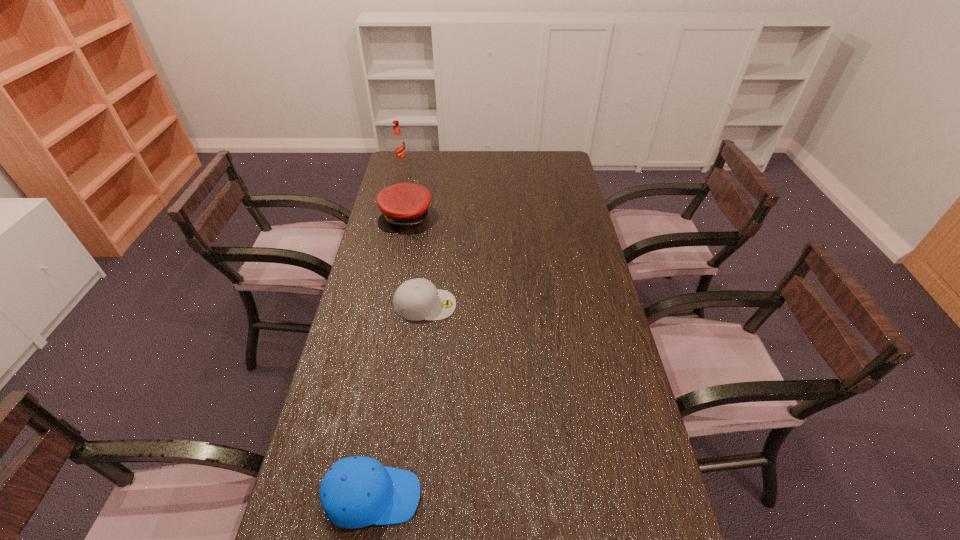
Where is `the farthest object`? Image resolution: width=960 pixels, height=540 pixels. the farthest object is located at coordinates (398, 143).

The image size is (960, 540). In order to click on the tallest object in this screenshot , I will do `click(398, 143)`.

I want to click on the third nearest object, so click(x=404, y=205).

Locate an element on the screen. The image size is (960, 540). the nearest cap is located at coordinates (356, 492).

This screenshot has height=540, width=960. Identify the location of the second nearest object. (417, 299).

At what (x,y) coordinates should I click in order to perform the action: click on the shortest object. Please return your answer as a coordinate pair (x, y). The image size is (960, 540). Looking at the image, I should click on (417, 299).

The height and width of the screenshot is (540, 960). In order to click on free space located on the front of the tallest object in this screenshot , I will do `click(394, 194)`.

Locate an element on the screen. The width and height of the screenshot is (960, 540). free spot located 0.190m on the front-facing side of the farthest cap is located at coordinates (396, 266).

In order to click on vacant space located on the front-facing side of the nearest object in this screenshot , I will do [x=559, y=496].

Where is `free spot located 0.190m on the front-facing side of the second nearest object`? free spot located 0.190m on the front-facing side of the second nearest object is located at coordinates (514, 305).